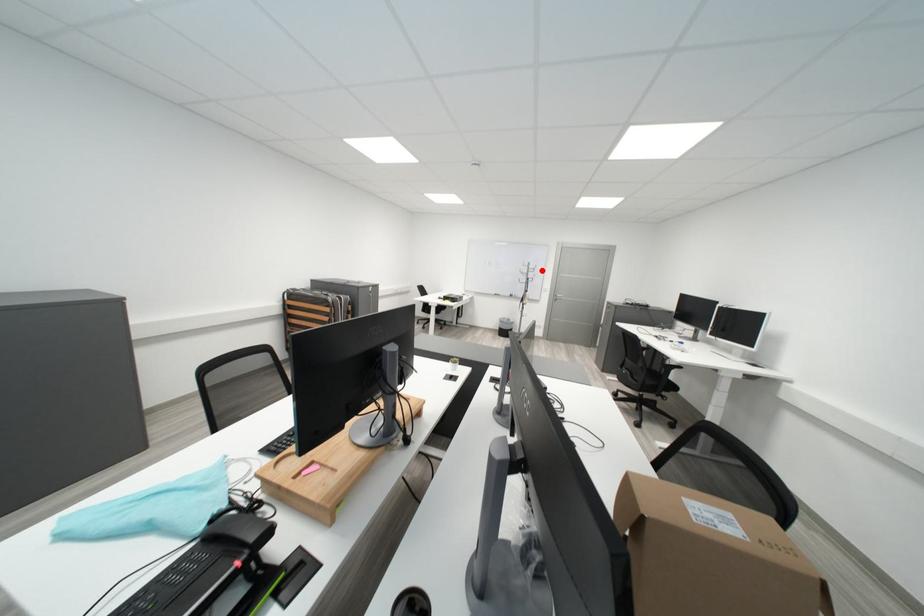
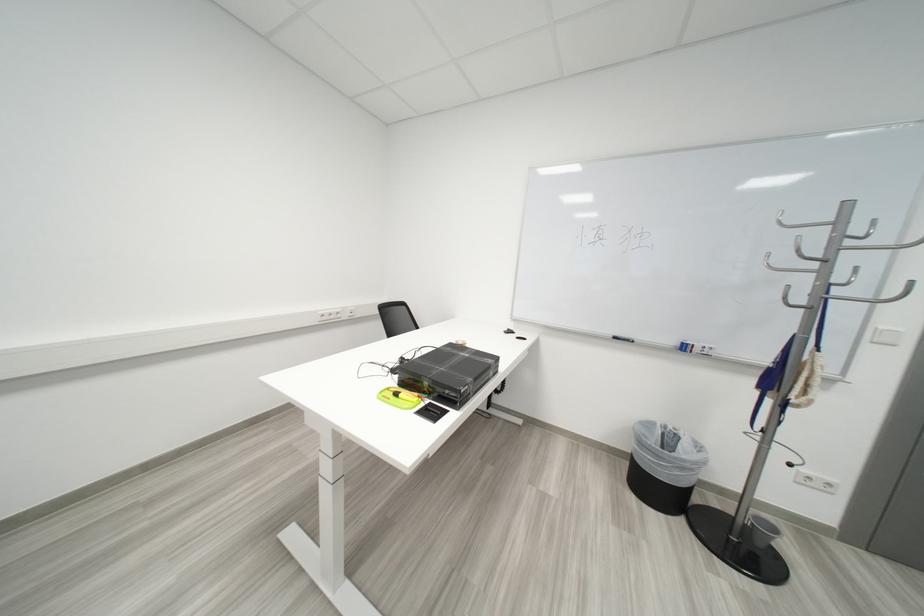
Where in the second image is the point corresponding to the highlighted location from the first image?

(853, 238)